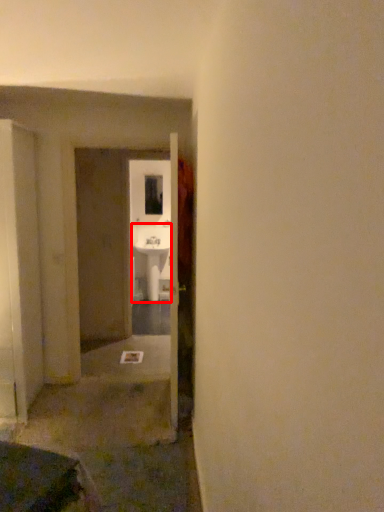
Question: Considering the relative positions of sink (annotated by the red box) and window in the image provided, where is sink (annotated by the red box) located with respect to the staircase?

Choices:
 (A) right
 (B) left

Answer: (A)